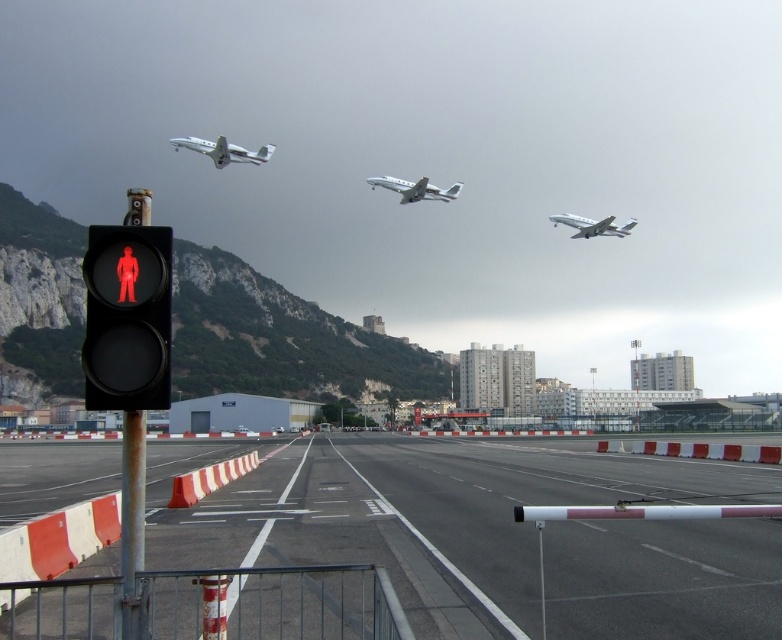
Question: Which of the following is the closest to the observer?

Choices:
 (A) white glossy airplane at upper left
 (B) metallic silver airplane at center

Answer: (A)

Question: Is metallic silver airplane at center thinner than metallic silver airplane at upper center?

Choices:
 (A) yes
 (B) no

Answer: (A)

Question: Among these objects, which one is nearest to the camera?

Choices:
 (A) metallic silver airplane at upper center
 (B) metallic silver airplane at center

Answer: (B)

Question: Where is black asphalt runway at center located in relation to black matte pedestrian signal at left in the image?

Choices:
 (A) right
 (B) left

Answer: (A)

Question: Which of these objects is positioned closest to the black matte pedestrian signal at left?

Choices:
 (A) metallic pole at left
 (B) metallic silver airplane at center
 (C) metallic silver airplane at upper center

Answer: (A)

Question: Does black asphalt runway at center appear under white glossy airplane at upper left?

Choices:
 (A) yes
 (B) no

Answer: (A)